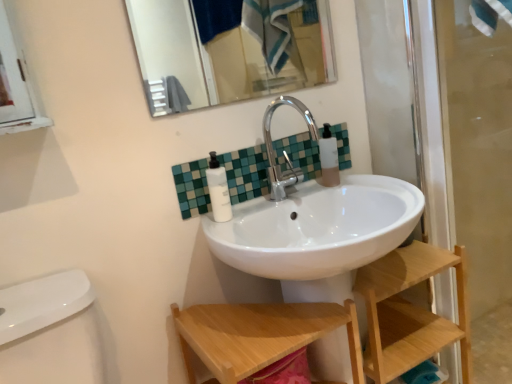
Question: Could you tell me if metallic silver mirror at upper center is turned towards wooden step stool at lower center?

Choices:
 (A) no
 (B) yes

Answer: (A)

Question: Is there a large distance between metallic silver mirror at upper center and wooden step stool at lower center?

Choices:
 (A) yes
 (B) no

Answer: (B)

Question: Considering the relative positions of metallic silver mirror at upper center and wooden step stool at lower center in the image provided, is metallic silver mirror at upper center to the right of wooden step stool at lower center from the viewer's perspective?

Choices:
 (A) no
 (B) yes

Answer: (A)

Question: From a real-world perspective, is metallic silver mirror at upper center positioned over wooden step stool at lower center based on gravity?

Choices:
 (A) no
 (B) yes

Answer: (B)

Question: From the image's perspective, is metallic silver mirror at upper center over wooden step stool at lower center?

Choices:
 (A) no
 (B) yes

Answer: (B)

Question: Visually, is wooden step stool at lower center positioned to the left or to the right of wooden shelf at lower right?

Choices:
 (A) right
 (B) left

Answer: (B)

Question: Relative to wooden shelf at lower right, is wooden step stool at lower center in front or behind?

Choices:
 (A) front
 (B) behind

Answer: (A)

Question: From the image's perspective, relative to wooden shelf at lower right, is wooden step stool at lower center above or below?

Choices:
 (A) above
 (B) below

Answer: (B)

Question: From their relative heights in the image, would you say wooden step stool at lower center is taller or shorter than wooden shelf at lower right?

Choices:
 (A) tall
 (B) short

Answer: (B)

Question: Relative to white matte pump bottle at center, which appears as the 1th toiletry when viewed from the front, is transparent glass screen door at right in front or behind?

Choices:
 (A) front
 (B) behind

Answer: (A)

Question: Is point (486, 205) closer or farther from the camera than point (217, 192)?

Choices:
 (A) closer
 (B) farther

Answer: (B)

Question: Considering the positions of transparent glass screen door at right and white matte pump bottle at center, which ranks as the first toiletry in left-to-right order, in the image, is transparent glass screen door at right bigger or smaller than white matte pump bottle at center, which ranks as the first toiletry in left-to-right order,?

Choices:
 (A) small
 (B) big

Answer: (B)

Question: From the image's perspective, relative to white matte pump bottle at center, arranged as the second toiletry when viewed from the back, is transparent glass screen door at right above or below?

Choices:
 (A) above
 (B) below

Answer: (B)

Question: Considering their positions, is green mosaic tile at center located in front of or behind translucent plastic bottle at upper right, which is counted as the 1th toiletry, starting from the back?

Choices:
 (A) behind
 (B) front

Answer: (B)

Question: From the image's perspective, is green mosaic tile at center located above or below translucent plastic bottle at upper right, the second toiletry when ordered from front to back?

Choices:
 (A) above
 (B) below

Answer: (B)